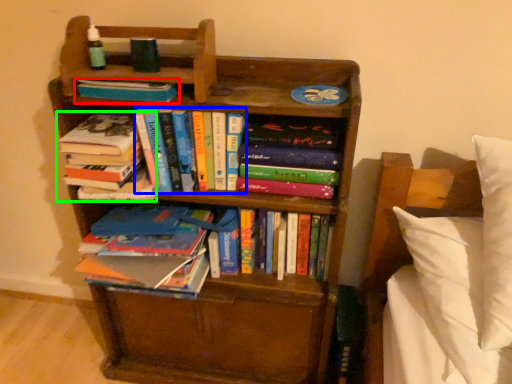
Question: Estimate the real-world distances between objects in this image. Which object is farther from book (highlighted by a red box), book (highlighted by a blue box) or book (highlighted by a green box)?

Choices:
 (A) book
 (B) book

Answer: (B)